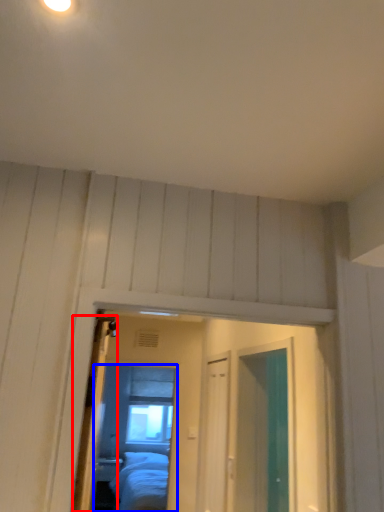
Question: Which of the following is the farthest to the observer, door (highlighted by a red box) or mirror (highlighted by a blue box)?

Choices:
 (A) door
 (B) mirror

Answer: (B)